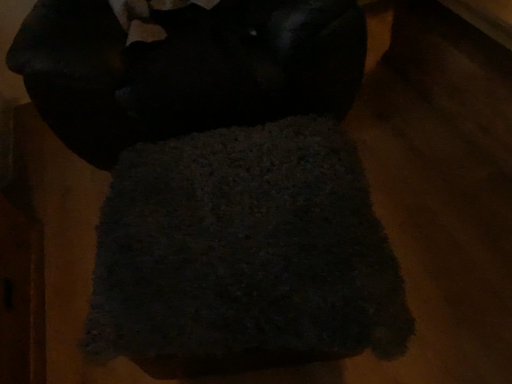
Question: Looking at the image, does dark textured towel at center seem bigger or smaller compared to dark wool rug at center?

Choices:
 (A) small
 (B) big

Answer: (A)

Question: From the image's perspective, is dark textured towel at center located above or below dark wool rug at center?

Choices:
 (A) below
 (B) above

Answer: (A)

Question: Relative to dark wool rug at center, is dark textured towel at center in front or behind?

Choices:
 (A) behind
 (B) front

Answer: (B)

Question: Considering the positions of dark wool rug at center and dark textured towel at center in the image, is dark wool rug at center taller or shorter than dark textured towel at center?

Choices:
 (A) tall
 (B) short

Answer: (A)

Question: Based on their sizes in the image, would you say dark wool rug at center is bigger or smaller than dark textured towel at center?

Choices:
 (A) big
 (B) small

Answer: (A)

Question: Looking at their shapes, would you say dark wool rug at center is wider or thinner than dark textured towel at center?

Choices:
 (A) thin
 (B) wide

Answer: (B)

Question: From a real-world perspective, is dark wool rug at center above or below dark textured towel at center?

Choices:
 (A) below
 (B) above

Answer: (B)